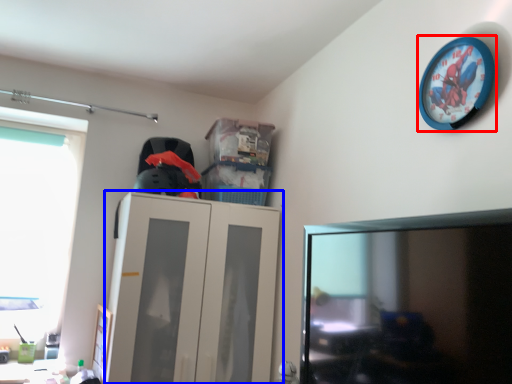
Question: Which object is closer to the camera taking this photo, wall clock (highlighted by a red box) or cabinetry (highlighted by a blue box)?

Choices:
 (A) wall clock
 (B) cabinetry

Answer: (A)